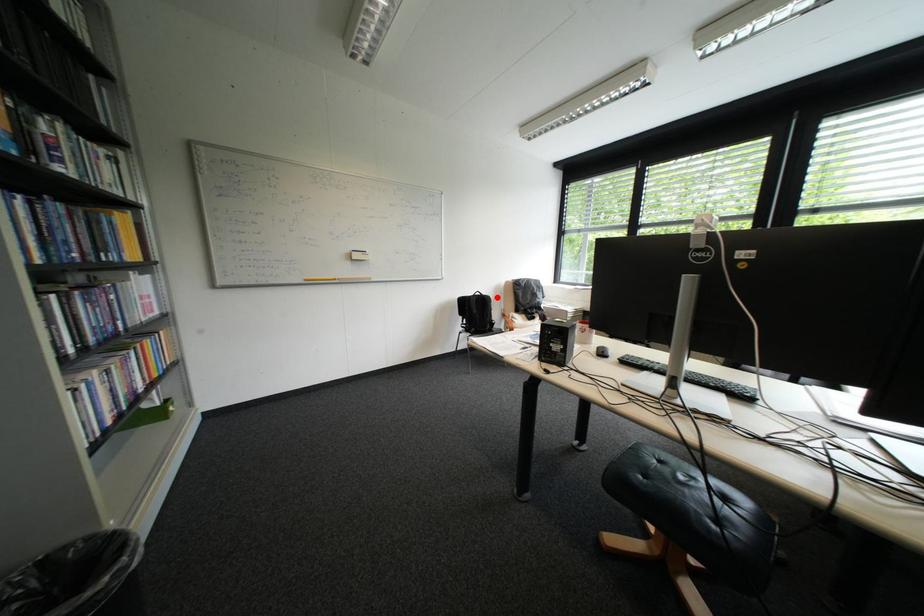
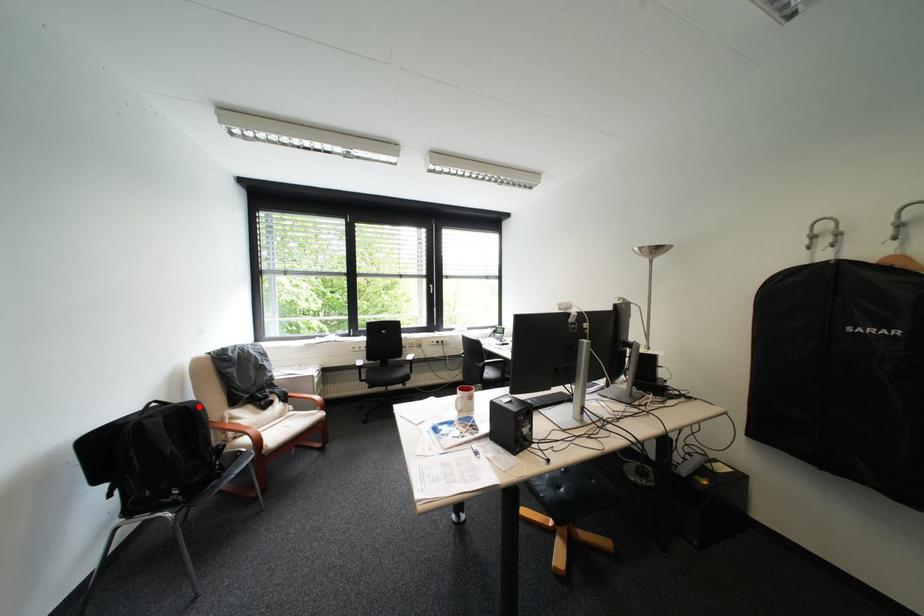
I am providing you with two images of the same scene from different viewpoints. A red point is marked on the first image and another point is marked on the second image. Do the highlighted points in image1 and image2 indicate the same real-world spot?

Yes